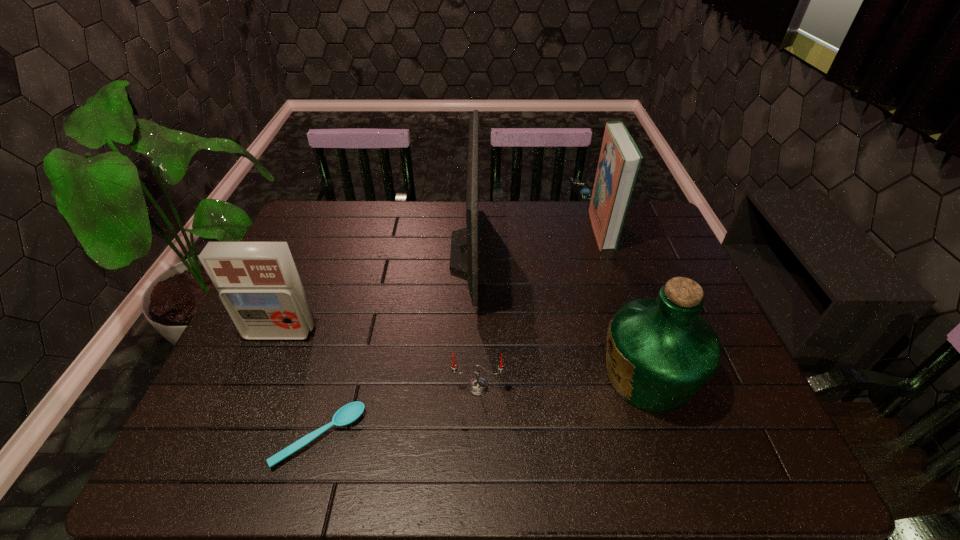
Select which object is the third closest to the hardback book. Please provide its 2D coordinates. Your answer should be formatted as a tuple, i.e. [(x, y)], where the tuple contains the x and y coordinates of a point satisfying the conditions above.

[(477, 386)]

Find the location of a particular element. vacant space that satisfies the following two spatial constraints: 1. on the front-facing side of the first-aid kit; 2. on the right side of the shortest object is located at coordinates (236, 437).

I want to click on vacant space that satisfies the following two spatial constraints: 1. on the front-facing side of the fifth object from right to left; 2. on the left side of the first-aid kit, so click(236, 437).

Image resolution: width=960 pixels, height=540 pixels. Identify the location of vacant space that satisfies the following two spatial constraints: 1. on the cover of the hardback book; 2. on the front-facing side of the leftmost object. (636, 333).

Find the location of a particular element. The image size is (960, 540). free region that satisfies the following two spatial constraints: 1. on the cover of the hardback book; 2. on the front-facing side of the second shortest object is located at coordinates (655, 387).

The image size is (960, 540). In order to click on free spot that satisfies the following two spatial constraints: 1. on the screen side of the monitor; 2. on the front-facing side of the leftmost object in this screenshot , I will do `click(466, 333)`.